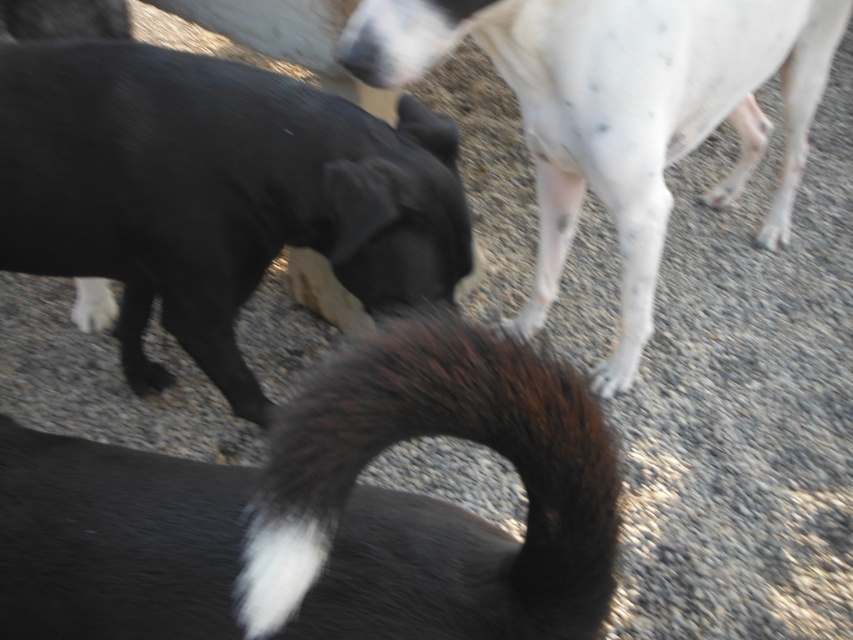
Question: In this image, where is black fur tail at center located relative to white speckled fur at upper right?

Choices:
 (A) below
 (B) above

Answer: (A)

Question: Which point appears closest to the camera in this image?

Choices:
 (A) (704, 104)
 (B) (556, 403)

Answer: (B)

Question: Which of the following is the farthest from the observer?

Choices:
 (A) (4, 154)
 (B) (434, 353)
 (C) (792, 76)

Answer: (C)

Question: Which point is farther from the camera taking this photo?

Choices:
 (A) (653, 202)
 (B) (433, 384)

Answer: (A)

Question: Can you confirm if black fur tail at center is thinner than matte black dog at left?

Choices:
 (A) no
 (B) yes

Answer: (B)

Question: Can you confirm if black fur tail at center is positioned above matte black dog at left?

Choices:
 (A) yes
 (B) no

Answer: (B)